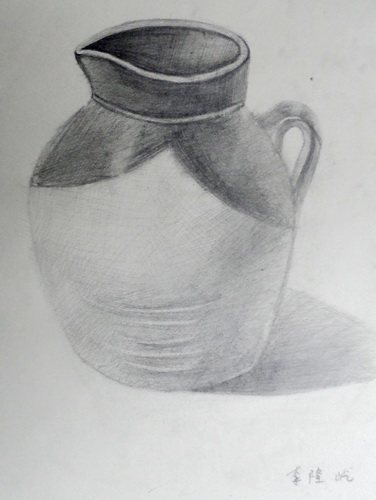
You are a GUI agent. You are given a task and a screenshot of the screen. Output one action in this format:
    pyautogui.click(x=<x>, y=<y>)
    Task: Click on the darker part of jug
    
    Given the screenshot: What is the action you would take?
    pyautogui.click(x=305, y=110), pyautogui.click(x=192, y=147), pyautogui.click(x=177, y=106), pyautogui.click(x=156, y=57)